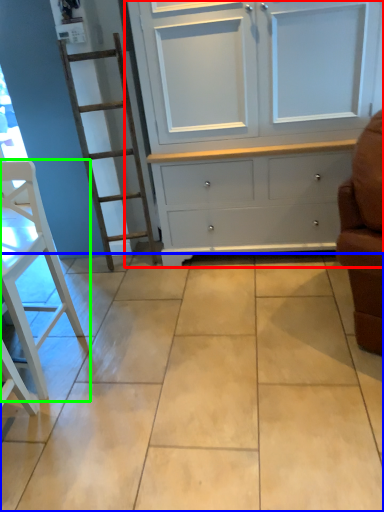
Question: Which object is positioned farthest from cupboard (highlighted by a red box)? Select from ceramic tile (highlighted by a blue box) and furniture (highlighted by a green box).

Choices:
 (A) ceramic tile
 (B) furniture

Answer: (B)